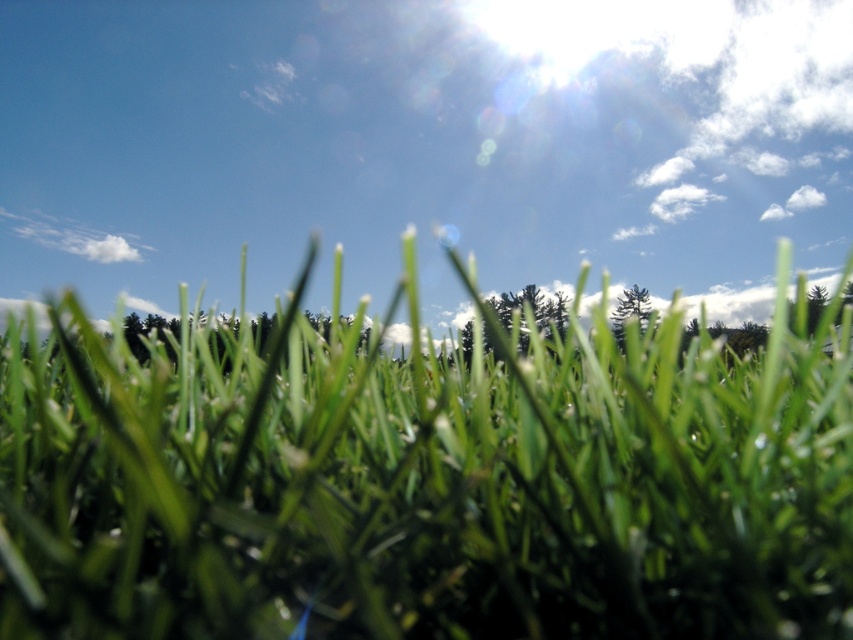
From the picture: Can you confirm if green grass at center is shorter than bright blue sky at upper center?

Correct, green grass at center is not as tall as bright blue sky at upper center.

Can you confirm if green grass at center is positioned to the left of bright blue sky at upper center?

Yes, green grass at center is to the left of bright blue sky at upper center.

Is point (572, 595) positioned in front of point (763, 76)?

Yes, point (572, 595) is in front of point (763, 76).

Image resolution: width=853 pixels, height=640 pixels. Find the location of `green grass at center`. green grass at center is located at coordinates 425,483.

Can you confirm if green grass at center is wider than green matte tree at center?

Correct, the width of green grass at center exceeds that of green matte tree at center.

Consider the image. Who is positioned more to the left, green grass at center or green matte tree at center?

green grass at center

Where is `green grass at center`? This screenshot has height=640, width=853. green grass at center is located at coordinates (425, 483).

Is bright blue sky at upper center below green matte tree at center?

Incorrect, bright blue sky at upper center is not positioned below green matte tree at center.

Between point (418, 113) and point (498, 308), which one is positioned behind?

Positioned behind is point (498, 308).

The image size is (853, 640). In order to click on bright blue sky at upper center in this screenshot , I will do `click(422, 144)`.